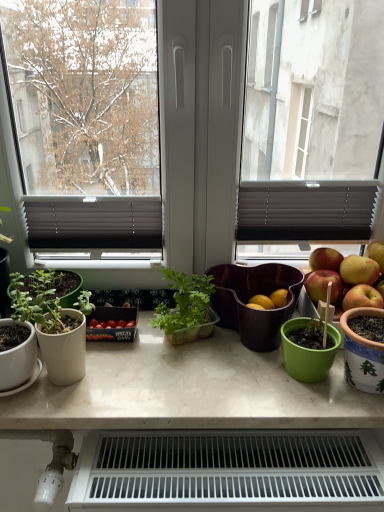
Image resolution: width=384 pixels, height=512 pixels. In order to click on matte purple salad bowl at center in this screenshot , I will do tap(250, 297).

What do you see at coordinates (363, 354) in the screenshot?
I see `christmas-patterned ceramic pot at right` at bounding box center [363, 354].

What do you see at coordinates (55, 330) in the screenshot? This screenshot has height=512, width=384. I see `matte white pot at left, which is counted as the first houseplant, starting from the left` at bounding box center [55, 330].

I want to click on matte purple salad bowl at center, so click(x=250, y=297).

Based on their sizes in the image, would you say matte purple salad bowl at center is bigger or smaller than white plastic radiator at lower center?

matte purple salad bowl at center is smaller than white plastic radiator at lower center.

Where is `salad bowl above the white plastic radiator at lower center (from a real-world perspective)`? Image resolution: width=384 pixels, height=512 pixels. salad bowl above the white plastic radiator at lower center (from a real-world perspective) is located at coordinates (250, 297).

Is white plastic radiator at lower center a part of matte purple salad bowl at center?

No, white plastic radiator at lower center is not surrounded by matte purple salad bowl at center.

How many degrees apart are the facing directions of matte purple salad bowl at center and white plastic radiator at lower center?

1.77 degrees.

Is translucent plastic plant container at center, which is the 2th houseplant in left-to-right order, to the left of white plastic radiator at lower center from the viewer's perspective?

Indeed, translucent plastic plant container at center, which is the 2th houseplant in left-to-right order, is positioned on the left side of white plastic radiator at lower center.

From the image's perspective, which is above, translucent plastic plant container at center, which is the 2th houseplant in left-to-right order, or white plastic radiator at lower center?

From the image's view, translucent plastic plant container at center, which is the 2th houseplant in left-to-right order, is above.

Is point (183, 306) more distant than point (148, 459)?

Yes, point (183, 306) is farther from viewer.

Is translucent plastic plant container at center, which is the 2th houseplant in left-to-right order, positioned beyond the bounds of white plastic radiator at lower center?

That's correct, translucent plastic plant container at center, which is the 2th houseplant in left-to-right order, is outside of white plastic radiator at lower center.

How different are the orientations of white plastic radiator at lower center and matte purple salad bowl at center in degrees?

The facing directions of white plastic radiator at lower center and matte purple salad bowl at center are 1.77 degrees apart.

Find the location of a particular element. The height and width of the screenshot is (512, 384). appliance on the left of matte purple salad bowl at center is located at coordinates (227, 470).

Is white plastic radiator at lower center positioned in front of matte purple salad bowl at center?

Yes, white plastic radiator at lower center is closer to the viewer.

From a real-world perspective, is white marble table at center physically above matte white pot at left, which is counted as the first houseplant, starting from the left?

No.

Considering the sizes of objects white marble table at center and matte white pot at left, which is counted as the first houseplant, starting from the left, in the image provided, who is wider, white marble table at center or matte white pot at left, which is counted as the first houseplant, starting from the left,?

white marble table at center is wider.

From the image's perspective, is white marble table at center below matte white pot at left, which is the 2th houseplant from right to left?

Yes, from the image's perspective, white marble table at center is below matte white pot at left, which is the 2th houseplant from right to left.

Could you tell me if white marble table at center is turned towards matte white pot at left, which is the 2th houseplant from right to left?

No, white marble table at center is not aimed at matte white pot at left, which is the 2th houseplant from right to left.

Is christmas-patterned ceramic pot at right not near white marble table at center?

No, christmas-patterned ceramic pot at right is in close proximity to white marble table at center.

From a real-world perspective, is christmas-patterned ceramic pot at right under white marble table at center?

No, from a real-world perspective, christmas-patterned ceramic pot at right is not below white marble table at center.

From the image's perspective, which object appears higher, christmas-patterned ceramic pot at right or white marble table at center?

christmas-patterned ceramic pot at right appears higher in the image.

Is christmas-patterned ceramic pot at right looking in the opposite direction of white marble table at center?

christmas-patterned ceramic pot at right is not turned away from white marble table at center.

Who is shorter, white plastic radiator at lower center or white marble table at center?

white marble table at center is shorter.

Can you tell me how much white plastic radiator at lower center and white marble table at center differ in facing direction?

white plastic radiator at lower center and white marble table at center are facing 0.608 degrees away from each other.

This screenshot has height=512, width=384. What are the coordinates of `table behind the white plastic radiator at lower center` in the screenshot? It's located at (190, 390).

Consider the image. Which of these two, white plastic radiator at lower center or white marble table at center, is smaller?

With smaller size is white marble table at center.

Consider the image. How many degrees apart are the facing directions of christmas-patterned ceramic pot at right and translucent plastic plant container at center, the first houseplant when ordered from right to left?

They differ by 0.262 degrees in their facing directions.

Would you say christmas-patterned ceramic pot at right is a long distance from translucent plastic plant container at center, which is the 2th houseplant in left-to-right order?

That's not correct — christmas-patterned ceramic pot at right is a little close to translucent plastic plant container at center, which is the 2th houseplant in left-to-right order.

Is christmas-patterned ceramic pot at right closer to camera compared to translucent plastic plant container at center, which is the 2th houseplant in left-to-right order?

Yes, christmas-patterned ceramic pot at right is closer to the viewer.

The image size is (384, 512). What are the coordinates of `salad bowl behind the white plastic radiator at lower center` in the screenshot? It's located at (250, 297).

Where is `appliance lying in front of the translucent plastic plant container at center, the first houseplant when ordered from right to left`? This screenshot has width=384, height=512. appliance lying in front of the translucent plastic plant container at center, the first houseplant when ordered from right to left is located at coordinates (227, 470).

Estimate the real-world distances between objects in this image. Which object is closer to white marble table at center, translucent plastic plant container at center, the first houseplant when ordered from right to left, or matte purple salad bowl at center?

The object closer to white marble table at center is translucent plastic plant container at center, the first houseplant when ordered from right to left.

Based on their spatial positions, is christmas-patterned ceramic pot at right or matte purple salad bowl at center further from translucent plastic plant container at center, the first houseplant when ordered from right to left?

The object further to translucent plastic plant container at center, the first houseplant when ordered from right to left, is christmas-patterned ceramic pot at right.

When comparing their distances from translucent plastic plant container at center, which is the 2th houseplant in left-to-right order, does christmas-patterned ceramic pot at right or white plastic radiator at lower center seem further?

christmas-patterned ceramic pot at right is positioned further to the anchor translucent plastic plant container at center, which is the 2th houseplant in left-to-right order.

When comparing their distances from white plastic radiator at lower center, does translucent plastic plant container at center, the first houseplant when ordered from right to left, or christmas-patterned ceramic pot at right seem closer?

christmas-patterned ceramic pot at right is positioned closer to the anchor white plastic radiator at lower center.

Looking at the image, which one is located closer to white plastic radiator at lower center, matte purple salad bowl at center or matte white pot at left, which is the 2th houseplant from right to left?

The object closer to white plastic radiator at lower center is matte purple salad bowl at center.

From the image, which object appears to be farther from christmas-patterned ceramic pot at right, translucent plastic plant container at center, the first houseplant when ordered from right to left, or white marble table at center?

Based on the image, translucent plastic plant container at center, the first houseplant when ordered from right to left, appears to be further to christmas-patterned ceramic pot at right.

Based on their spatial positions, is white marble table at center or christmas-patterned ceramic pot at right closer to matte purple salad bowl at center?

The object closer to matte purple salad bowl at center is white marble table at center.

Considering their positions, is matte purple salad bowl at center positioned closer to christmas-patterned ceramic pot at right than white plastic radiator at lower center?

The object closer to christmas-patterned ceramic pot at right is matte purple salad bowl at center.

Where is `table between matte white pot at left, which is the 2th houseplant from right to left, and matte purple salad bowl at center, in the horizontal direction`? The image size is (384, 512). table between matte white pot at left, which is the 2th houseplant from right to left, and matte purple salad bowl at center, in the horizontal direction is located at coordinates (x=190, y=390).

Locate an element on the screen. The height and width of the screenshot is (512, 384). table located between translucent plastic plant container at center, the first houseplant when ordered from right to left, and christmas-patterned ceramic pot at right in the left-right direction is located at coordinates (190, 390).

Find the location of a particular element. This screenshot has height=512, width=384. salad bowl situated between white marble table at center and christmas-patterned ceramic pot at right from left to right is located at coordinates (250, 297).

Locate an element on the screen. Image resolution: width=384 pixels, height=512 pixels. appliance located between white marble table at center and christmas-patterned ceramic pot at right in the left-right direction is located at coordinates (227, 470).